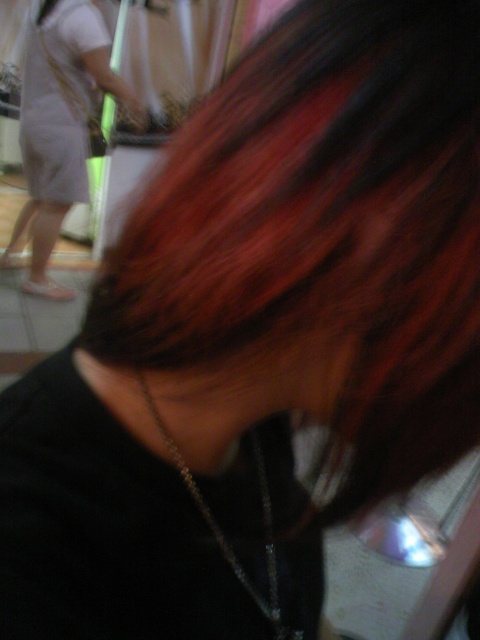
Is matte white dress at upper left thinner than silver metallic chain at center?

Incorrect, matte white dress at upper left's width is not less than silver metallic chain at center's.

Is point (70, 291) positioned after point (157, 424)?

Yes, it is.

What do you see at coordinates (60, 122) in the screenshot? I see `matte white dress at upper left` at bounding box center [60, 122].

Identify the location of matte white dress at upper left. The height and width of the screenshot is (640, 480). (60, 122).

The width and height of the screenshot is (480, 640). I want to click on shiny dark brown hair at center, so click(x=316, y=248).

Does shiny dark brown hair at center come in front of matte white dress at upper left?

Yes, it is in front of matte white dress at upper left.

Does point (132, 422) lie behind point (88, 13)?

No, (132, 422) is closer to viewer.

The height and width of the screenshot is (640, 480). Find the location of `shiny dark brown hair at center`. shiny dark brown hair at center is located at coordinates (316, 248).

The height and width of the screenshot is (640, 480). Describe the element at coordinates (316, 248) in the screenshot. I see `shiny dark brown hair at center` at that location.

Between point (229, 378) and point (147, 390), which one is positioned behind?

Positioned behind is point (147, 390).

What do you see at coordinates (316, 248) in the screenshot? The image size is (480, 640). I see `shiny dark brown hair at center` at bounding box center [316, 248].

This screenshot has height=640, width=480. I want to click on shiny dark brown hair at center, so click(316, 248).